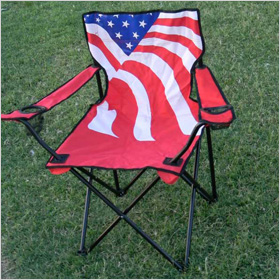
This screenshot has width=280, height=280. What are the coordinates of `cup holders` in the screenshot? It's located at (218, 108), (36, 112).